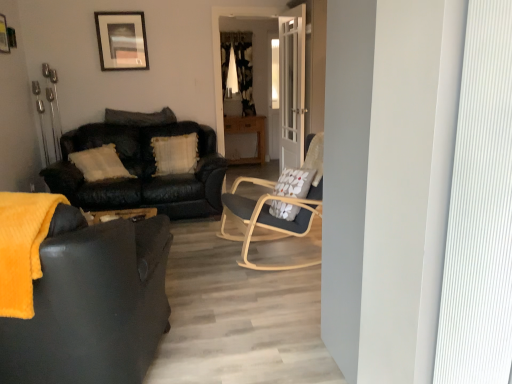
Describe the element at coordinates (175, 154) in the screenshot. I see `white textured pillow at center, marked as the second pillow in a top-to-bottom arrangement` at that location.

Where is `matte black picture frame at upper center, the second picture frame viewed from the front`? Image resolution: width=512 pixels, height=384 pixels. matte black picture frame at upper center, the second picture frame viewed from the front is located at coordinates (122, 40).

This screenshot has width=512, height=384. What do you see at coordinates (141, 169) in the screenshot?
I see `leather couch at center, which appears as the 1th studio couch when viewed from the back` at bounding box center [141, 169].

This screenshot has width=512, height=384. Describe the element at coordinates (140, 117) in the screenshot. I see `black matte pillow at upper center, positioned as the second pillow in bottom-to-top order` at that location.

At what (x,y) coordinates should I click in order to perform the action: click on white textured pillow at center, marked as the second pillow in a top-to-bottom arrangement. Please return your answer as a coordinate pair (x, y). Looking at the image, I should click on (175, 154).

Considering the positions of objects black matte pillow at upper center, positioned as the second pillow in bottom-to-top order, and light wood/woodenchair at center in the image provided, who is more to the right, black matte pillow at upper center, positioned as the second pillow in bottom-to-top order, or light wood/woodenchair at center?

light wood/woodenchair at center is more to the right.

Can you tell me how much black matte pillow at upper center, which appears as the 1th pillow when viewed from the top, and light wood/woodenchair at center differ in facing direction?

The facing directions of black matte pillow at upper center, which appears as the 1th pillow when viewed from the top, and light wood/woodenchair at center are 82.6 degrees apart.

The width and height of the screenshot is (512, 384). In order to click on chair on the right of black matte pillow at upper center, positioned as the second pillow in bottom-to-top order in this screenshot , I will do tap(268, 218).

Considering the sizes of objects black matte pillow at upper center, which appears as the 1th pillow when viewed from the top, and light wood/woodenchair at center in the image provided, who is shorter, black matte pillow at upper center, which appears as the 1th pillow when viewed from the top, or light wood/woodenchair at center?

black matte pillow at upper center, which appears as the 1th pillow when viewed from the top.

Which is closer to the camera, (302, 18) or (242, 85)?

Clearly, point (302, 18) is closer to the camera than point (242, 85).

Does white glass door at center have a greater height compared to black/white textured curtain at center?

Yes.

Considering the relative positions of white glass door at center and black/white textured curtain at center in the image provided, is white glass door at center in front of black/white textured curtain at center?

Yes, white glass door at center is closer to the camera.

Considering the positions of objects white glass door at center and black/white textured curtain at center in the image provided, who is more to the left, white glass door at center or black/white textured curtain at center?

From the viewer's perspective, black/white textured curtain at center appears more on the left side.

From the image's perspective, which pillow is the 1st one above the matte black couch at left, which appears as the first studio couch when viewed from the front? Please provide its 2D coordinates.

[(175, 154)]

Does white textured pillow at center, which ranks as the 1th pillow in bottom-to-top order, have a larger size compared to matte black couch at left, acting as the second studio couch starting from the back?

Actually, white textured pillow at center, which ranks as the 1th pillow in bottom-to-top order, might be smaller than matte black couch at left, acting as the second studio couch starting from the back.

Is white textured pillow at center, which ranks as the 1th pillow in bottom-to-top order, thinner than matte black couch at left, acting as the second studio couch starting from the back?

Yes, white textured pillow at center, which ranks as the 1th pillow in bottom-to-top order, is thinner than matte black couch at left, acting as the second studio couch starting from the back.

Can you confirm if white textured pillow at center, marked as the second pillow in a top-to-bottom arrangement, is taller than matte black couch at left, which appears as the first studio couch when viewed from the front?

In fact, white textured pillow at center, marked as the second pillow in a top-to-bottom arrangement, may be shorter than matte black couch at left, which appears as the first studio couch when viewed from the front.

From the image's perspective, would you say matte black couch at left, acting as the second studio couch starting from the back, is shown under matte black picture frame at upper center, which is the second picture frame in left-to-right order?

Yes.

In the scene shown: Considering the positions of objects matte black couch at left, which appears as the first studio couch when viewed from the front, and matte black picture frame at upper center, which is the 1th picture frame in back-to-front order, in the image provided, who is more to the right, matte black couch at left, which appears as the first studio couch when viewed from the front, or matte black picture frame at upper center, which is the 1th picture frame in back-to-front order,?

matte black couch at left, which appears as the first studio couch when viewed from the front, is more to the right.

Considering the positions of objects white textured pillow at center, which ranks as the 1th pillow in bottom-to-top order, and light wood/woodenchair at center in the image provided, who is in front, white textured pillow at center, which ranks as the 1th pillow in bottom-to-top order, or light wood/woodenchair at center?

Positioned in front is light wood/woodenchair at center.

Is white textured pillow at center, which ranks as the 1th pillow in bottom-to-top order, facing away from light wood/woodenchair at center?

No.

From the image's perspective, is white textured pillow at center, marked as the second pillow in a top-to-bottom arrangement, located above or below light wood/woodenchair at center?

Clearly, from the image's perspective, white textured pillow at center, marked as the second pillow in a top-to-bottom arrangement, is above light wood/woodenchair at center.

Can you confirm if wooden cabinet at center is thinner than light wood/woodenchair at center?

Yes.

Is wooden cabinet at center oriented towards light wood/woodenchair at center?

Yes, wooden cabinet at center is oriented towards light wood/woodenchair at center.

Considering the sizes of objects wooden cabinet at center and light wood/woodenchair at center in the image provided, who is taller, wooden cabinet at center or light wood/woodenchair at center?

light wood/woodenchair at center.

From a real-world perspective, which is physically below, wooden cabinet at center or light wood/woodenchair at center?

In real-world perspective, wooden cabinet at center is lower.

Is black matte pillow at upper center, which appears as the 1th pillow when viewed from the top, to the right of white glass door at center from the viewer's perspective?

No, black matte pillow at upper center, which appears as the 1th pillow when viewed from the top, is not to the right of white glass door at center.

The height and width of the screenshot is (384, 512). Identify the location of door above the black matte pillow at upper center, positioned as the second pillow in bottom-to-top order (from a real-world perspective). (292, 87).

How different are the orientations of black matte pillow at upper center, which appears as the 1th pillow when viewed from the top, and white glass door at center in degrees?

85.7 degrees.

Is black matte pillow at upper center, which appears as the 1th pillow when viewed from the top, spatially inside white glass door at center, or outside of it?

black matte pillow at upper center, which appears as the 1th pillow when viewed from the top, is not enclosed by white glass door at center.

Find the location of a particular element. chair in front of the black matte pillow at upper center, which appears as the 1th pillow when viewed from the top is located at coordinates (268, 218).

At what (x,y) coordinates should I click in order to perform the action: click on door on the right of the black/white textured curtain at center. Please return your answer as a coordinate pair (x, y). This screenshot has width=512, height=384. Looking at the image, I should click on pos(292,87).

Based on their spatial positions, is leather couch at center, which appears as the 1th studio couch when viewed from the back, or matte black picture frame at upper center, which is the second picture frame in left-to-right order, further from black/white textured curtain at center?

leather couch at center, which appears as the 1th studio couch when viewed from the back, lies further to black/white textured curtain at center than the other object.

Considering their positions, is matte black couch at left, acting as the second studio couch starting from the back, positioned closer to white glass door at center than matte black picture frame at upper center, which is the 1th picture frame in back-to-front order?

Among the two, matte black picture frame at upper center, which is the 1th picture frame in back-to-front order, is located nearer to white glass door at center.

Looking at the image, which one is located closer to leather couch at center, placed as the 2th studio couch when sorted from front to back, wooden cabinet at center or light wood/woodenchair at center?

light wood/woodenchair at center lies closer to leather couch at center, placed as the 2th studio couch when sorted from front to back, than the other object.

From the image, which object appears to be nearer to light wood/woodenchair at center, white textured pillow at center, marked as the second pillow in a top-to-bottom arrangement, or matte black picture frame at upper center, which is the 1th picture frame in back-to-front order?

white textured pillow at center, marked as the second pillow in a top-to-bottom arrangement, is closer to light wood/woodenchair at center.

Looking at the image, which one is located closer to black/white textured curtain at center, matte black couch at left, which appears as the first studio couch when viewed from the front, or white glass door at center?

white glass door at center is closer to black/white textured curtain at center.

Looking at this image, based on their spatial positions, is matte black couch at left, which appears as the first studio couch when viewed from the front, or matte black picture frame at upper center, which is the 1th picture frame in back-to-front order, closer to light wood/woodenchair at center?

matte black couch at left, which appears as the first studio couch when viewed from the front.

Looking at the image, which one is located further to matte black picture frame at upper center, the second picture frame viewed from the front, black/white textured curtain at center or leather couch at center, which appears as the 1th studio couch when viewed from the back?

leather couch at center, which appears as the 1th studio couch when viewed from the back, lies further to matte black picture frame at upper center, the second picture frame viewed from the front, than the other object.

Considering their positions, is brushed metal picture frame at upper left, which is counted as the 2th picture frame, starting from the back, positioned closer to matte black couch at left, which appears as the first studio couch when viewed from the front, than light wood/woodenchair at center?

light wood/woodenchair at center is positioned closer to the anchor matte black couch at left, which appears as the first studio couch when viewed from the front.

At what (x,y) coordinates should I click in order to perform the action: click on door between brushed metal picture frame at upper left, arranged as the 1th picture frame when viewed from the left, and black/white textured curtain at center from front to back. Please return your answer as a coordinate pair (x, y). Image resolution: width=512 pixels, height=384 pixels. Looking at the image, I should click on (292, 87).

The height and width of the screenshot is (384, 512). What are the coordinates of `door between matte black couch at left, acting as the second studio couch starting from the back, and matte black picture frame at upper center, the 1th picture frame when ordered from right to left, in the front-back direction` in the screenshot? It's located at (292, 87).

At what (x,y) coordinates should I click in order to perform the action: click on curtain between light wood/woodenchair at center and wooden cabinet at center from front to back. Please return your answer as a coordinate pair (x, y). This screenshot has height=384, width=512. Looking at the image, I should click on (238, 68).

You are a GUI agent. You are given a task and a screenshot of the screen. Output one action in this format:
    pyautogui.click(x=<x>, y=<y>)
    Task: Click on the pillow between matte black picture frame at upper center, which is the 1th picture frame in back-to-front order, and white textured pillow at center, which ranks as the 1th pillow in bottom-to-top order, in the vertical direction
    This screenshot has height=384, width=512.
    Given the screenshot: What is the action you would take?
    pyautogui.click(x=140, y=117)